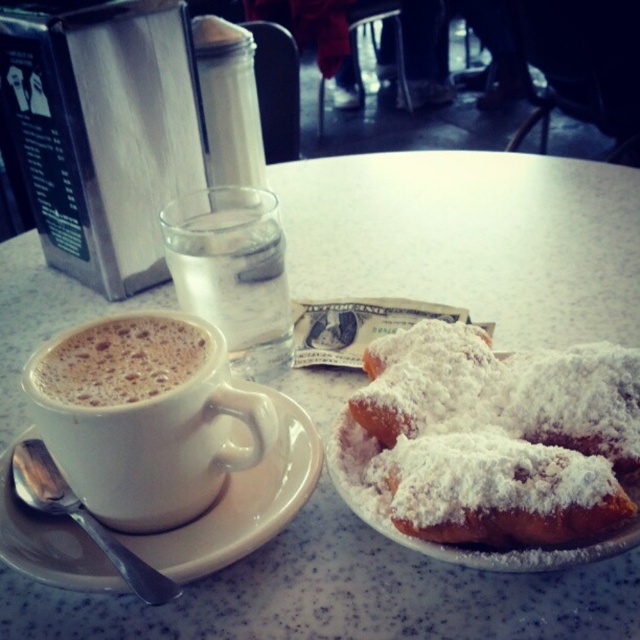
You are sitting at the table in the cozy cafe scene. There are two points marked on the table surface. One is at coordinates point [458,483] and the other is at point [256,232]. If you were to reach out to touch both points starting from your current position, which point would you touch first?

Point [458,483] is in front of point [256,232], so you would touch point [458,483] first.

You are a customer at the cozy cafe and want to place your phone on the table. The phone is 15 cm long. The table is 1 meter wide. The white ceramic saucer at left is located at point (241, 500). Is there enough space on the table to place your phone without overlapping the saucer?

The white ceramic saucer at left is located at point (241, 500). Since the table is 1 meter wide and the phone is only 15 cm long, there should be sufficient space to place the phone on the table without overlapping the saucer as long as it is positioned away from the saucer.